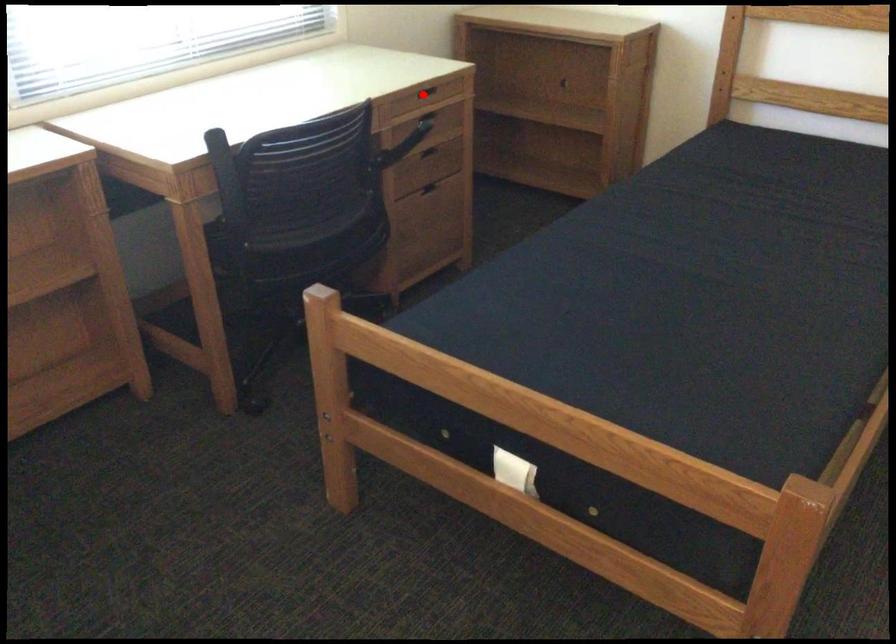
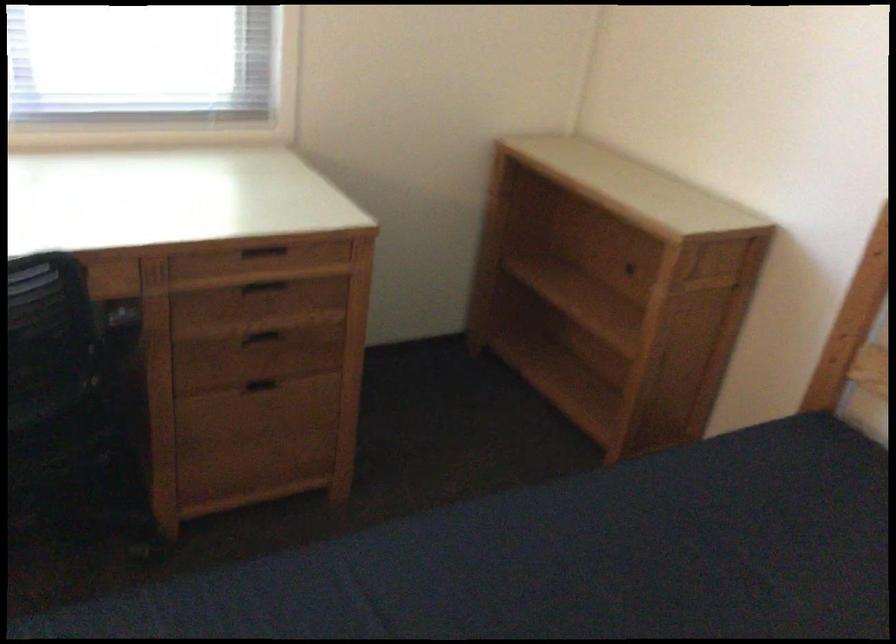
Locate, in the second image, the point that corresponds to the highlighted location in the first image.

(263, 252)